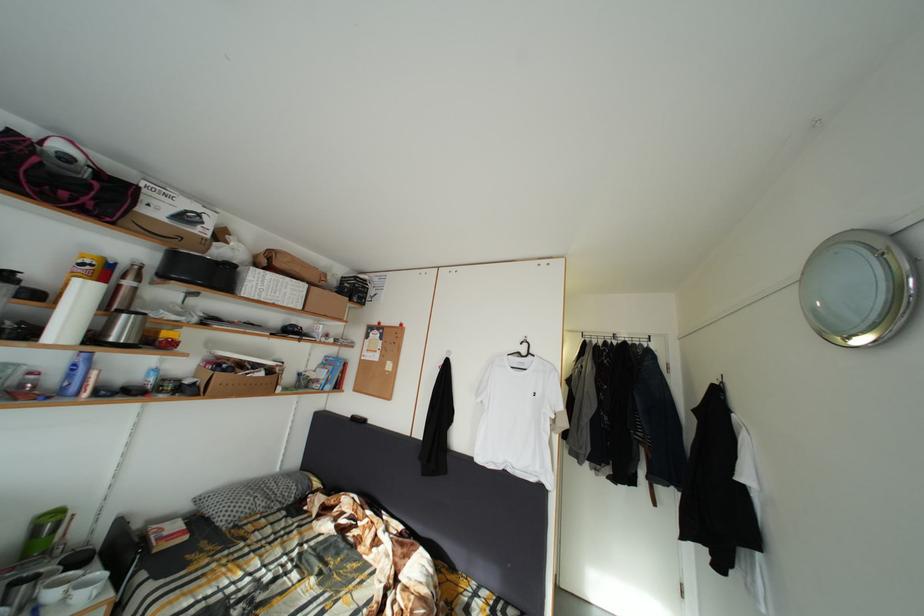
This screenshot has height=616, width=924. Describe the element at coordinates (721, 382) in the screenshot. I see `the metal wall hook` at that location.